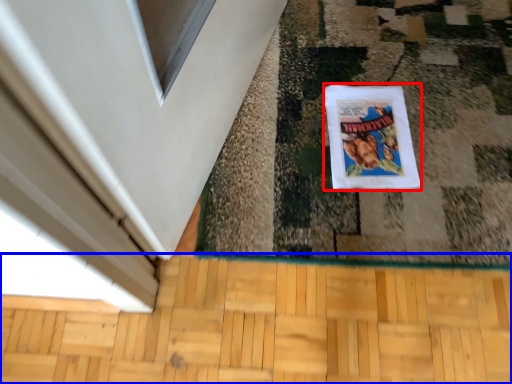
Question: Which object is further to the camera taking this photo, comic book (highlighted by a red box) or hardwood (highlighted by a blue box)?

Choices:
 (A) comic book
 (B) hardwood

Answer: (A)